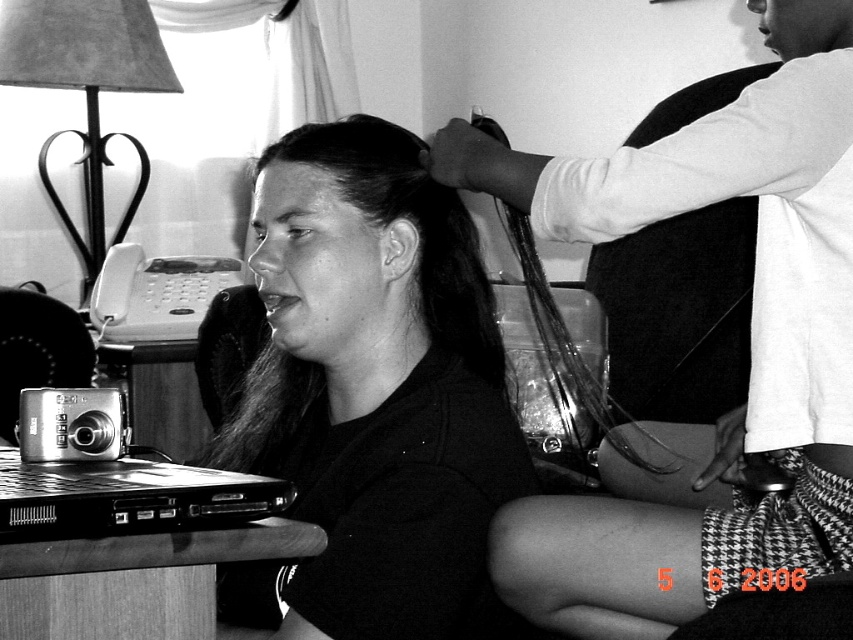
Looking at this image, you are organizing a photo album and want to ensure the black plastic laptop at lower left is visible in the image. Since the smooth dark hair at center might be blocking it, can you confirm if the laptop is still visible?

The smooth dark hair at center is above the black plastic laptop at lower left, so the laptop is still visible below the hair.

Based on the scene described, where is the smooth white arm at upper right located in the image?

The smooth white arm at upper right is located at point (751, 340) in the image.

You are a photographer trying to capture a closeup of the smooth white arm at upper right and the black plastic laptop at lower left in the scene. Which object should you focus on first if you want to ensure both are in focus without adjusting the camera settings?

The smooth white arm at upper right is taller than the black plastic laptop at lower left, so focusing on the smooth white arm at upper right first will help keep both in focus since it is closer to the camera.